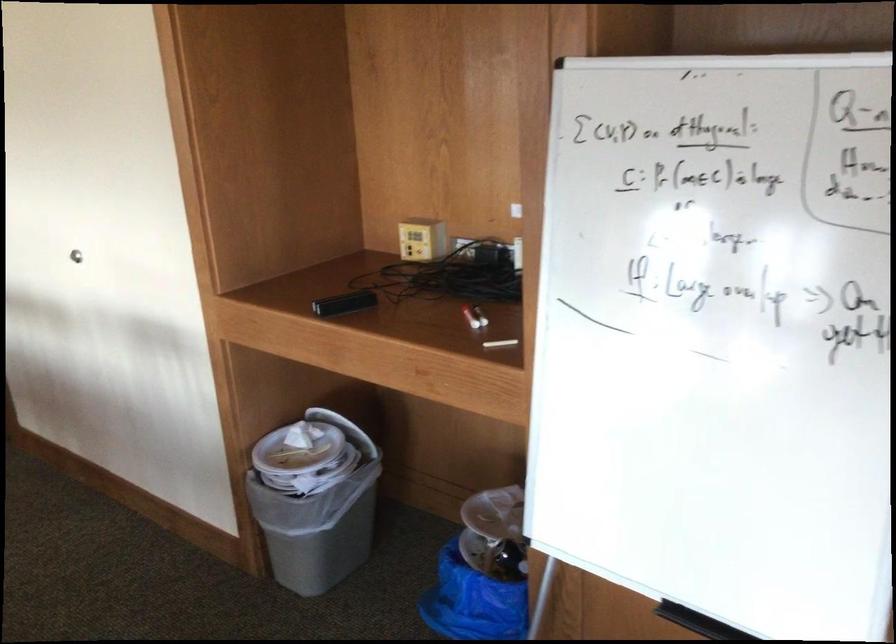
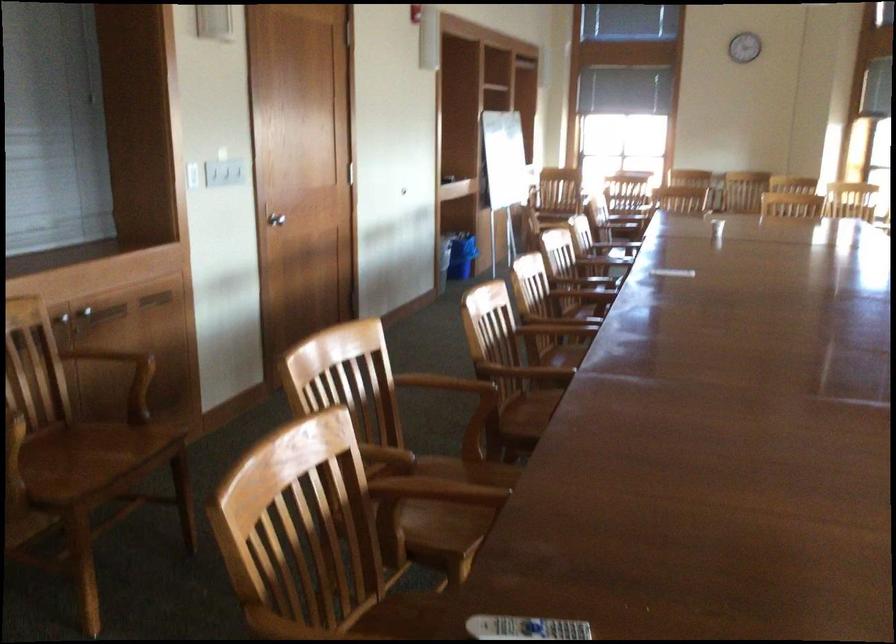
Question: I am providing you with two images of the same scene from different viewpoints. After the viewpoint changes to image2, which objects are now occluded?

Choices:
 (A) blue trash bag
 (B) blue trash can
 (C) white light switch
 (D) machine front panel

Answer: (A)